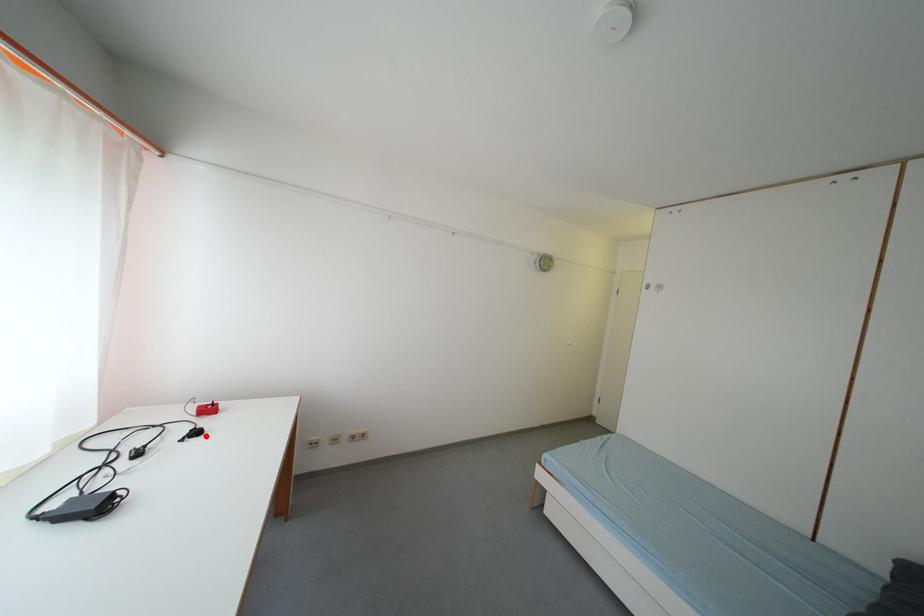
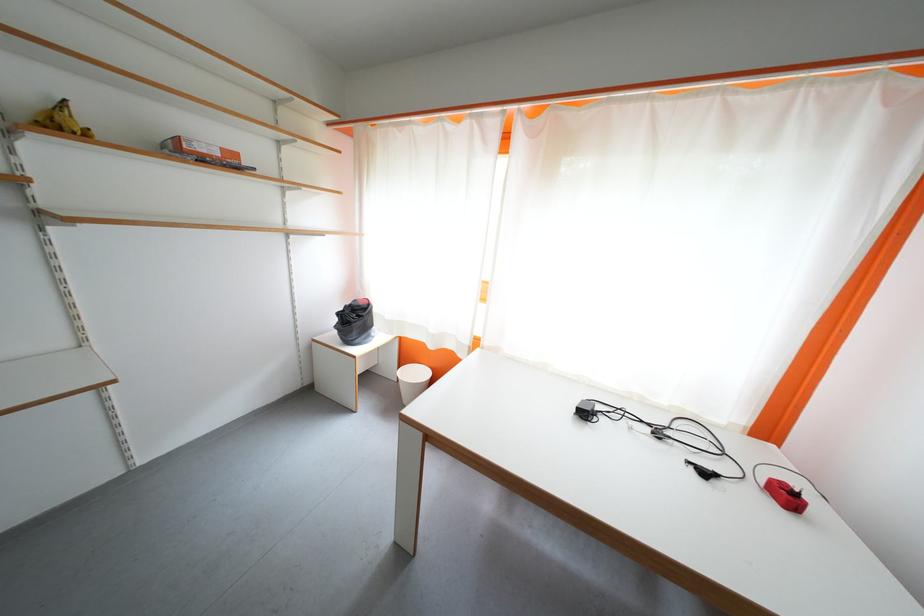
Find the pixel in the second image that matches the highlighted location in the first image.

(713, 477)